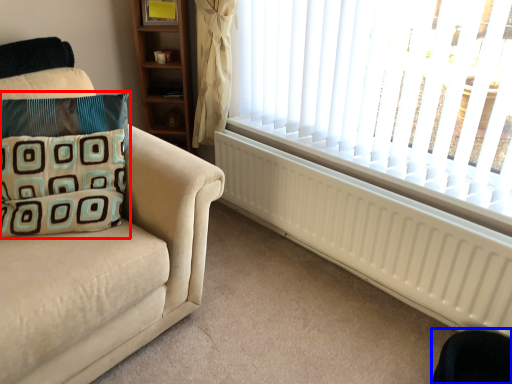
Question: Among these objects, which one is nearest to the camera, pillow (highlighted by a red box) or swivel chair (highlighted by a blue box)?

Choices:
 (A) pillow
 (B) swivel chair

Answer: (B)